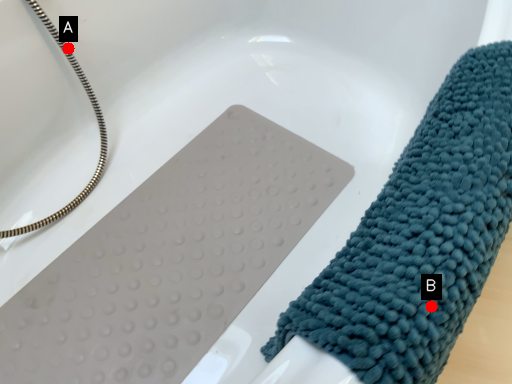
Question: Two points are circled on the image, labeled by A and B beside each circle. Which point is further to the camera?

Choices:
 (A) A is further
 (B) B is further

Answer: (A)